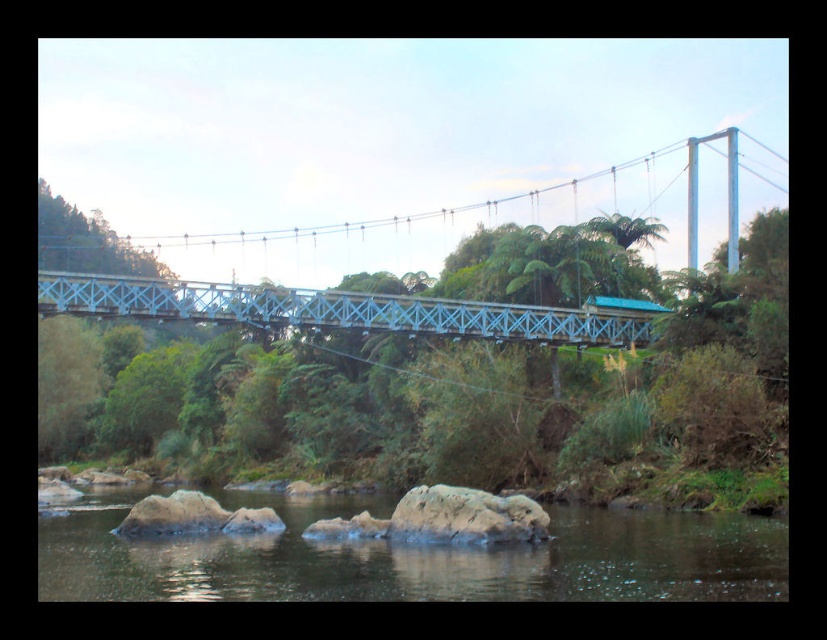
Question: Among these objects, which one is nearest to the camera?

Choices:
 (A) brown smooth rock at lower center
 (B) smooth gray rock at center
 (C) smooth rock at lower center
 (D) blue metallic bridge at center

Answer: (C)

Question: Is blue metallic bridge at center in front of brown smooth rock at lower center?

Choices:
 (A) no
 (B) yes

Answer: (A)

Question: Is smooth rock at lower center behind smooth gray rock at center?

Choices:
 (A) yes
 (B) no

Answer: (B)

Question: Is the position of blue metallic bridge at center more distant than that of smooth gray rock at center?

Choices:
 (A) no
 (B) yes

Answer: (B)

Question: Which point appears closest to the camera in this image?

Choices:
 (A) pyautogui.click(x=192, y=292)
 (B) pyautogui.click(x=763, y=595)
 (C) pyautogui.click(x=461, y=486)
 (D) pyautogui.click(x=141, y=525)

Answer: (B)

Question: Which point appears farthest from the camera in this image?

Choices:
 (A) (476, 580)
 (B) (347, 323)
 (C) (464, 490)
 (D) (128, 518)

Answer: (B)